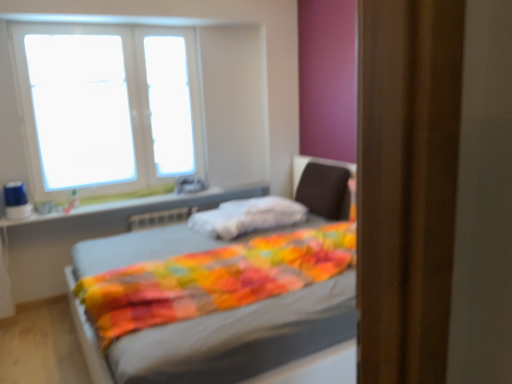
Question: From their relative heights in the image, would you say multicolored quilted blanket at center is taller or shorter than dark brown fabric swivel chair at center?

Choices:
 (A) tall
 (B) short

Answer: (B)

Question: Is multicolored quilted blanket at center spatially inside dark brown fabric swivel chair at center, or outside of it?

Choices:
 (A) outside
 (B) inside

Answer: (A)

Question: Based on their relative distances, which object is farther from the transparent glass window at upper left, the 1th window screen viewed from the left?

Choices:
 (A) dark brown fabric swivel chair at center
 (B) multicolored quilted blanket at center
 (C) white plastic window sill at upper left
 (D) transparent glass window at upper center, the first window screen viewed from the right
 (E) white plastic window at upper left

Answer: (A)

Question: Based on their relative distances, which object is farther from the white plastic window sill at upper left?

Choices:
 (A) transparent glass window at upper center, the first window screen viewed from the right
 (B) dark brown fabric swivel chair at center
 (C) multicolored quilted blanket at center
 (D) transparent glass window at upper left, the 1th window screen viewed from the left
 (E) white plastic window at upper left

Answer: (B)